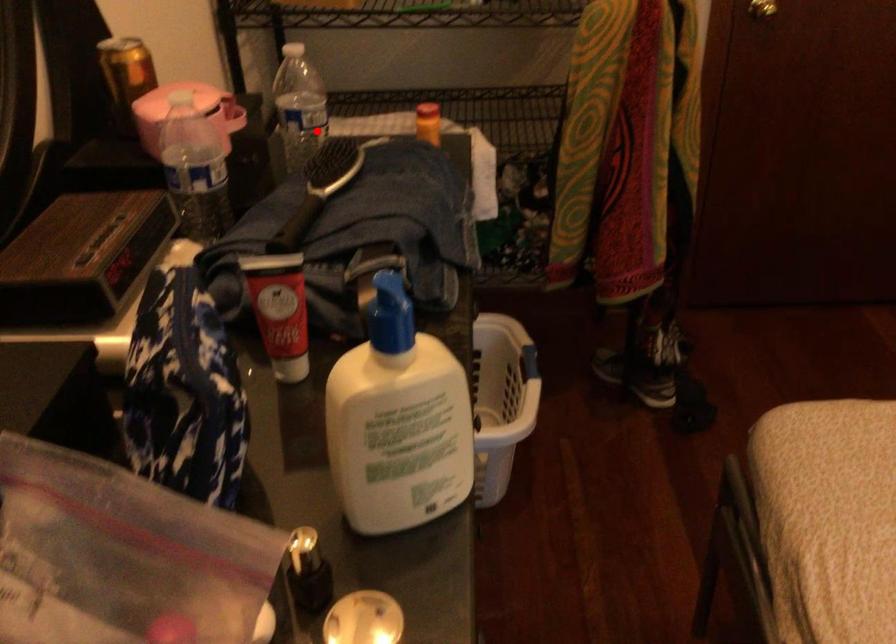
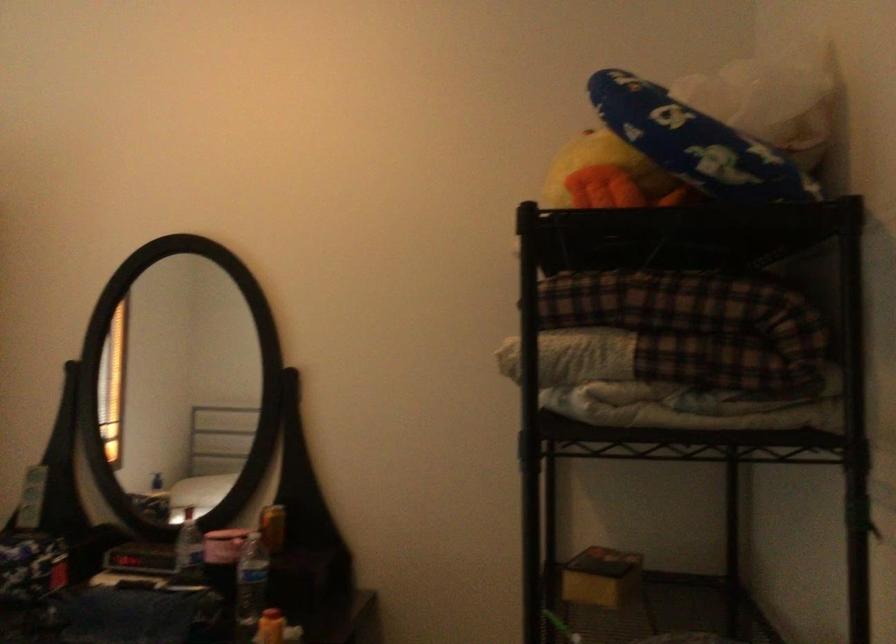
Question: I am providing you with two images of the same scene from different viewpoints. In image1, a red point is highlighted. Considering the same 3D point in image2, which of the following is correct?

Choices:
 (A) It is closer
 (B) It is farther

Answer: (B)